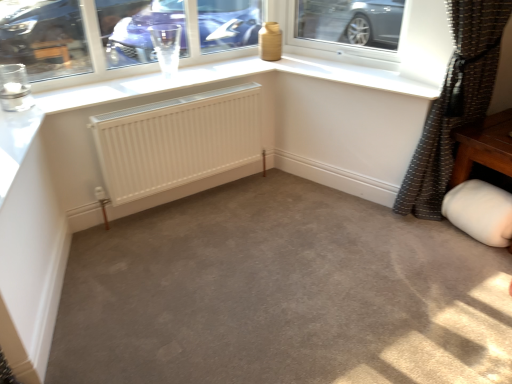
Question: Considering the relative positions of brown textured curtain at right and transparent glass at upper center in the image provided, is brown textured curtain at right in front of transparent glass at upper center?

Choices:
 (A) yes
 (B) no

Answer: (A)

Question: From a real-world perspective, is brown textured curtain at right over transparent glass at upper center?

Choices:
 (A) no
 (B) yes

Answer: (A)

Question: Can you confirm if brown textured curtain at right is positioned to the right of transparent glass at upper center?

Choices:
 (A) yes
 (B) no

Answer: (A)

Question: Is transparent glass at upper center at the back of brown textured curtain at right?

Choices:
 (A) yes
 (B) no

Answer: (B)

Question: Can you confirm if brown textured curtain at right is wider than transparent glass at upper center?

Choices:
 (A) yes
 (B) no

Answer: (A)

Question: From a real-world perspective, is transparent glass at upper center physically located above or below white matte jar at lower right?

Choices:
 (A) above
 (B) below

Answer: (A)

Question: Is transparent glass at upper center in front of or behind white matte jar at lower right in the image?

Choices:
 (A) behind
 (B) front

Answer: (B)

Question: In the image, is transparent glass at upper center on the left side or the right side of white matte jar at lower right?

Choices:
 (A) right
 (B) left

Answer: (B)

Question: Considering the positions of point (281, 26) and point (456, 190), is point (281, 26) closer or farther from the camera than point (456, 190)?

Choices:
 (A) closer
 (B) farther

Answer: (B)

Question: Is white matte jar at lower right inside or outside of transparent glass at upper center?

Choices:
 (A) inside
 (B) outside

Answer: (B)

Question: In the image, is white matte jar at lower right positioned in front of or behind transparent glass at upper center?

Choices:
 (A) front
 (B) behind

Answer: (B)

Question: Is white matte jar at lower right taller or shorter than transparent glass at upper center?

Choices:
 (A) short
 (B) tall

Answer: (A)

Question: Does point (501, 243) appear closer or farther from the camera than point (192, 26)?

Choices:
 (A) farther
 (B) closer

Answer: (B)

Question: Is brown textured curtain at right to the left or to the right of white matte jar at lower right in the image?

Choices:
 (A) left
 (B) right

Answer: (A)

Question: Considering the positions of brown textured curtain at right and white matte jar at lower right in the image, is brown textured curtain at right taller or shorter than white matte jar at lower right?

Choices:
 (A) short
 (B) tall

Answer: (B)